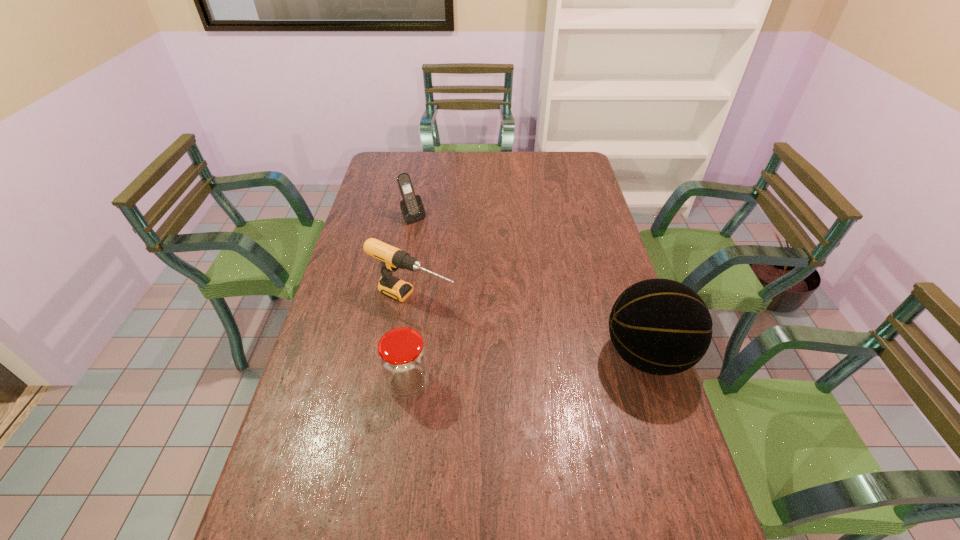
The height and width of the screenshot is (540, 960). In order to click on jar in this screenshot , I will do `click(402, 356)`.

Where is `the tallest object`? This screenshot has width=960, height=540. the tallest object is located at coordinates (659, 326).

The image size is (960, 540). Identify the location of basketball. (659, 326).

In order to click on the third nearest object in this screenshot , I will do `click(392, 258)`.

At what (x,y) coordinates should I click in order to perform the action: click on cellular telephone. Please return your answer as a coordinate pair (x, y). The image size is (960, 540). Looking at the image, I should click on (411, 206).

What are the coordinates of `free space located on the front of the jar` in the screenshot? It's located at (397, 462).

Image resolution: width=960 pixels, height=540 pixels. Find the location of `free space located on the left of the tallest object`. free space located on the left of the tallest object is located at coordinates (494, 355).

You are a GUI agent. You are given a task and a screenshot of the screen. Output one action in this format:
    pyautogui.click(x=<x>, y=<y>)
    Task: Click on the vacant region located on the handle side of the second farthest object
    This screenshot has width=960, height=540.
    Given the screenshot: What is the action you would take?
    (523, 343)

This screenshot has height=540, width=960. Identify the location of vacant space located on the handle side of the second farthest object. (565, 363).

Identify the location of vacant space located 0.240m on the handle side of the second farthest object. This screenshot has height=540, width=960. (520, 342).